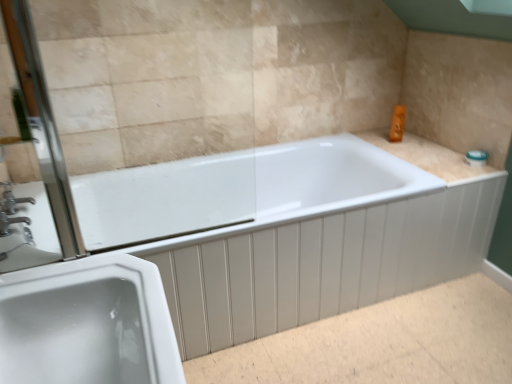
Identify the location of vacant space situated above beige tile counter top at upper right (from a real-world perspective). (432, 152).